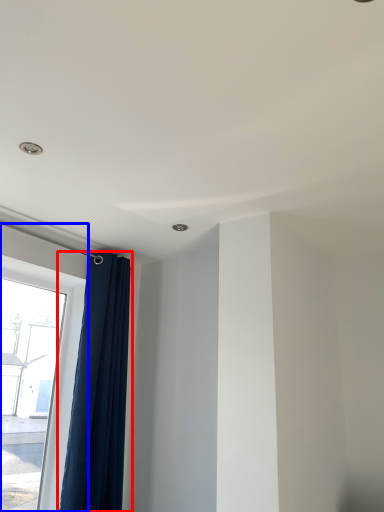
Question: Which object appears farthest to the camera in this image, curtain (highlighted by a red box) or window (highlighted by a blue box)?

Choices:
 (A) curtain
 (B) window

Answer: (A)